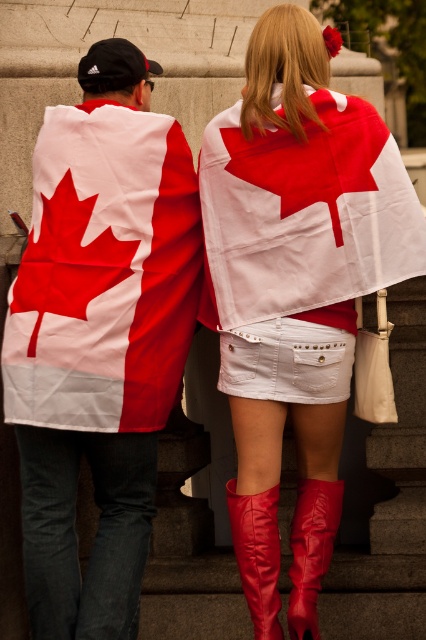
You are a photographer trying to capture a candid shot of the matte white denim skirt at center without the matte fabric flag at center blocking the view. Based on their heights, is it possible to take the shot from below the subjects?

The matte fabric flag at center is taller than the matte white denim skirt at center, so taking a shot from below might still result in the flag blocking the skirt if the angle isn

You are a photographer trying to capture a clear shot of the white denim skirt at center and the white fabric flag at center. Since both are white, you need to adjust your camera focus. Which object should you focus on to ensure the skirt is in focus while the flag is slightly blurred?

The white denim skirt at center is behind the white fabric flag at center, so focusing on the skirt would require focusing further back. To have the skirt in focus and the flag blurred, adjust the focus to the skirt, as it is positioned behind the flag.